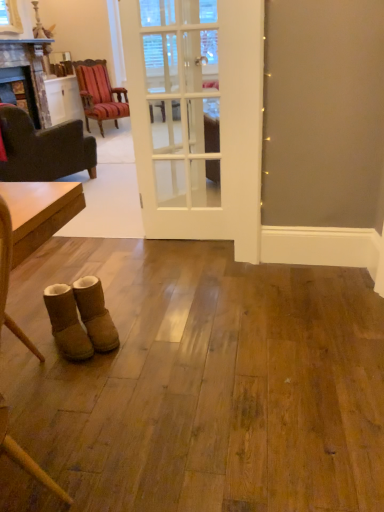
Question: Is there a large distance between wooden polished table at left and dark brown fabric armchair at left, which appears as the second chair when viewed from the back?

Choices:
 (A) yes
 (B) no

Answer: (A)

Question: From the image's perspective, is wooden polished table at left located beneath dark brown fabric armchair at left, the first chair ordered from the bottom?

Choices:
 (A) yes
 (B) no

Answer: (A)

Question: Is wooden polished table at left in front of dark brown fabric armchair at left, which appears as the second chair when viewed from the back?

Choices:
 (A) no
 (B) yes

Answer: (B)

Question: From a real-world perspective, is wooden polished table at left beneath dark brown fabric armchair at left, the 1th chair in the front-to-back sequence?

Choices:
 (A) yes
 (B) no

Answer: (B)

Question: Are wooden polished table at left and dark brown fabric armchair at left, the first chair ordered from the bottom, beside each other?

Choices:
 (A) yes
 (B) no

Answer: (B)

Question: Is point (241, 197) positioned closer to the camera than point (56, 324)?

Choices:
 (A) farther
 (B) closer

Answer: (A)

Question: From the image's perspective, is white glass door at center positioned above or below suede boots at lower left, which ranks as the first footwear in left-to-right order?

Choices:
 (A) below
 (B) above

Answer: (B)

Question: From a real-world perspective, is white glass door at center above or below suede boots at lower left, acting as the second footwear starting from the right?

Choices:
 (A) below
 (B) above

Answer: (B)

Question: Would you say white glass door at center is inside or outside suede boots at lower left, which ranks as the first footwear in left-to-right order?

Choices:
 (A) outside
 (B) inside

Answer: (A)

Question: Is white glass door at center spatially inside wooden polished table at left, or outside of it?

Choices:
 (A) inside
 (B) outside

Answer: (B)

Question: Relative to wooden polished table at left, is white glass door at center in front or behind?

Choices:
 (A) behind
 (B) front

Answer: (A)

Question: Considering the positions of point (172, 224) and point (38, 215), is point (172, 224) closer or farther from the camera than point (38, 215)?

Choices:
 (A) closer
 (B) farther

Answer: (B)

Question: From a real-world perspective, is white glass door at center physically located above or below wooden polished table at left?

Choices:
 (A) above
 (B) below

Answer: (A)

Question: Is dark brown fabric armchair at left, placed as the second chair when sorted from top to bottom, bigger or smaller than marble fireplace at left?

Choices:
 (A) small
 (B) big

Answer: (B)

Question: In terms of width, does dark brown fabric armchair at left, the first chair ordered from the bottom, look wider or thinner when compared to marble fireplace at left?

Choices:
 (A) wide
 (B) thin

Answer: (A)